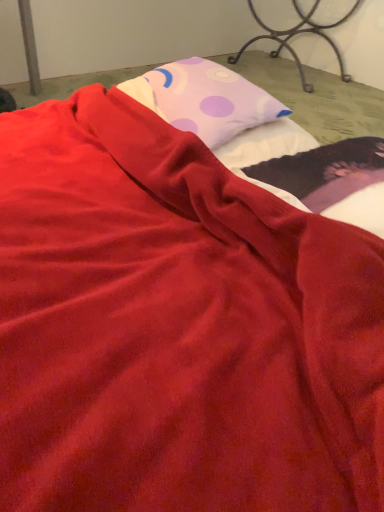
Question: Does metallic wrought iron bed frame at upper right have a lesser width compared to matte pink pillow at upper center?

Choices:
 (A) no
 (B) yes

Answer: (A)

Question: Considering the relative positions of metallic wrought iron bed frame at upper right and matte pink pillow at upper center in the image provided, is metallic wrought iron bed frame at upper right to the right of matte pink pillow at upper center from the viewer's perspective?

Choices:
 (A) yes
 (B) no

Answer: (A)

Question: Does metallic wrought iron bed frame at upper right appear on the left side of matte pink pillow at upper center?

Choices:
 (A) no
 (B) yes

Answer: (A)

Question: Is metallic wrought iron bed frame at upper right facing towards matte pink pillow at upper center?

Choices:
 (A) yes
 (B) no

Answer: (A)

Question: Is metallic wrought iron bed frame at upper right shorter than matte pink pillow at upper center?

Choices:
 (A) yes
 (B) no

Answer: (B)

Question: Considering the relative sizes of metallic wrought iron bed frame at upper right and matte pink pillow at upper center in the image provided, is metallic wrought iron bed frame at upper right taller than matte pink pillow at upper center?

Choices:
 (A) yes
 (B) no

Answer: (A)

Question: Is metallic wrought iron bed frame at upper right located within matte pink pillow at upper center?

Choices:
 (A) no
 (B) yes

Answer: (A)

Question: Does matte pink pillow at upper center have a smaller size compared to metallic wrought iron bed frame at upper right?

Choices:
 (A) yes
 (B) no

Answer: (A)

Question: Is matte pink pillow at upper center touching metallic wrought iron bed frame at upper right?

Choices:
 (A) yes
 (B) no

Answer: (B)

Question: Considering the relative sizes of matte pink pillow at upper center and metallic wrought iron bed frame at upper right in the image provided, is matte pink pillow at upper center thinner than metallic wrought iron bed frame at upper right?

Choices:
 (A) no
 (B) yes

Answer: (B)

Question: Is matte pink pillow at upper center to the left of metallic wrought iron bed frame at upper right from the viewer's perspective?

Choices:
 (A) no
 (B) yes

Answer: (B)

Question: Considering the relative sizes of matte pink pillow at upper center and metallic wrought iron bed frame at upper right in the image provided, is matte pink pillow at upper center shorter than metallic wrought iron bed frame at upper right?

Choices:
 (A) yes
 (B) no

Answer: (A)

Question: From the image's perspective, relative to metallic wrought iron bed frame at upper right, is matte pink pillow at upper center above or below?

Choices:
 (A) above
 (B) below

Answer: (B)